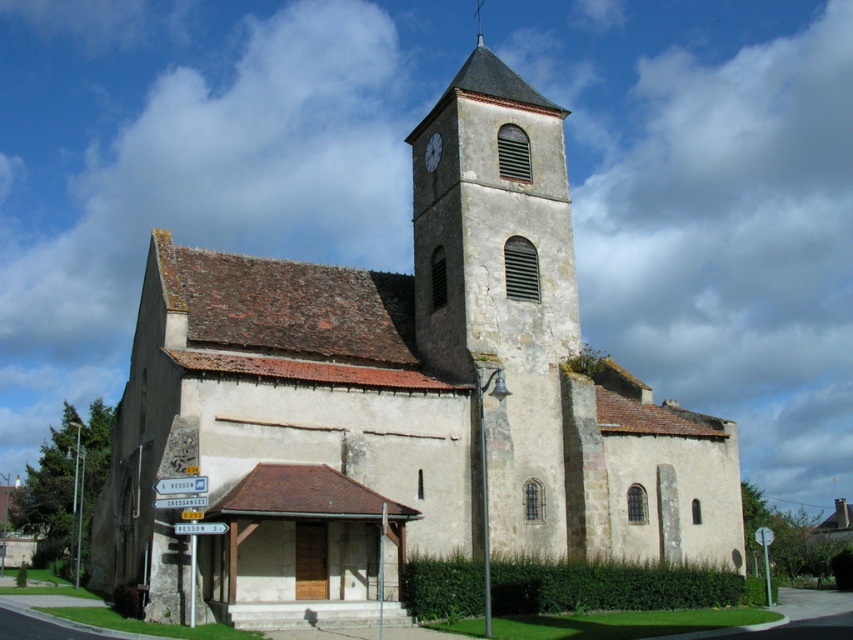
You are standing at point (498, 289) in the church image. What object is located exactly at this point?

The stone clock tower at center is located exactly at point (498, 289).

You are standing in front of the church and want to take a photo of the stone clock tower at center and the smooth gray spire at upper center. Which object should you focus on first if you want to capture both in a single frame without moving the camera?

The stone clock tower at center is positioned under the smooth gray spire at upper center, so you should focus on the stone clock tower at center first to ensure both are in the frame.

You are standing at the entrance of the church and want to find the stone clock tower at center. According to the image, in which direction should you look relative to your position?

The stone clock tower at center is located at point coordinates, so you should look towards the center of the image to find it.